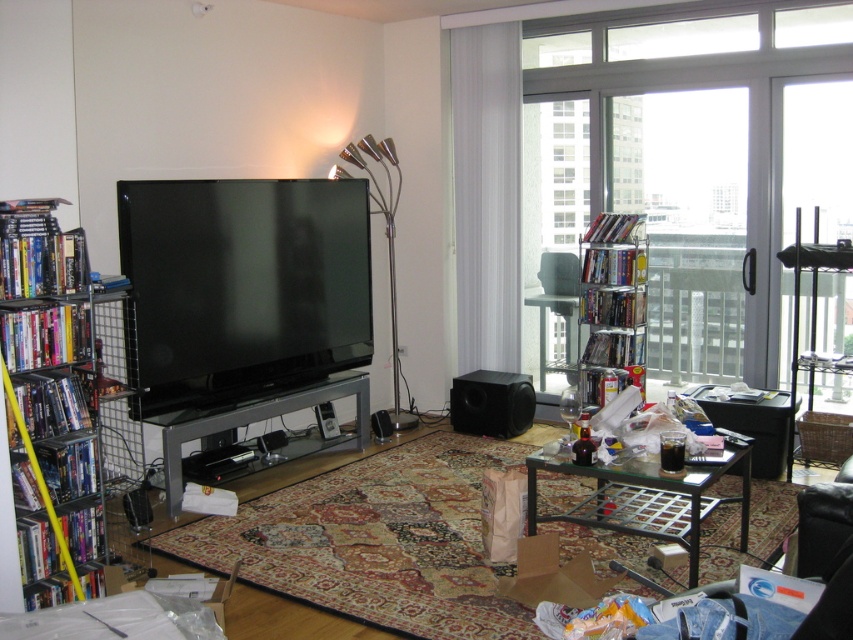
Question: Can you confirm if metallic wire bookshelf at left is positioned below metal/glass entertainment center at center?

Choices:
 (A) yes
 (B) no

Answer: (B)

Question: Which point appears farthest from the camera in this image?

Choices:
 (A) (195, 374)
 (B) (357, 380)
 (C) (683, 83)

Answer: (C)

Question: Can you confirm if transparent glass door at upper right is thinner than metal/glass entertainment center at center?

Choices:
 (A) yes
 (B) no

Answer: (B)

Question: Which is farther from the metallic wire bookshelf at left?

Choices:
 (A) black glossy flat screen tv at center
 (B) transparent glass door at upper right

Answer: (B)

Question: Based on their relative distances, which object is farther from the metallic wire bookshelf at left?

Choices:
 (A) transparent glass door at upper right
 (B) metal/glass entertainment center at center

Answer: (A)

Question: Is black glossy flat screen tv at center further to the viewer compared to metal/glass entertainment center at center?

Choices:
 (A) yes
 (B) no

Answer: (B)